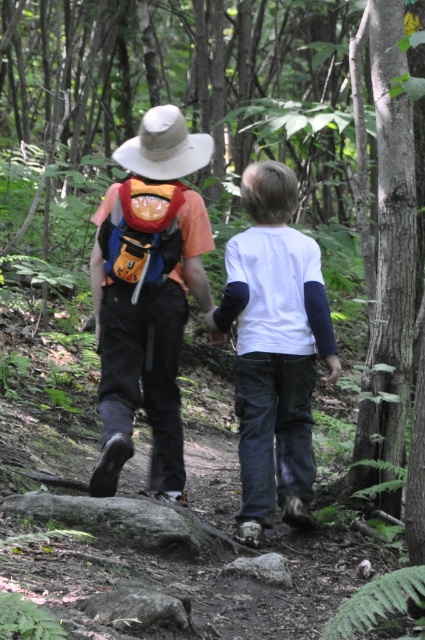
You are a photographer trying to capture a candid shot of the two people in the forest. You need to ensure that both the white cotton shirt at center and the orange fabric backpack at center are clearly visible in the frame. Given their sizes, which object should you focus on to ensure both are in focus?

The white cotton shirt at center is larger than the orange fabric backpack at center. To ensure both are in focus, focus on the white cotton shirt at center since it is larger and will require more precise focus to capture details.

You are a hiker planning to carry both the matte orange backpack at center and the white cotton shirt at center. Based on their positions in the image, which item is located to the left?

The matte orange backpack at center is positioned on the left side of the white cotton shirt at center, so it is located to the left.

You are standing at the camera position and want to reach the point at coordinates (x=300, y=301) in the forest. If your walking speed is 3 feet per second, how many seconds will it take you to reach that point?

The distance between the point at (x=300, y=301) and the camera is 18.35 feet. At a walking speed of 3 feet per second, it would take approximately 6.12 seconds to reach the point.